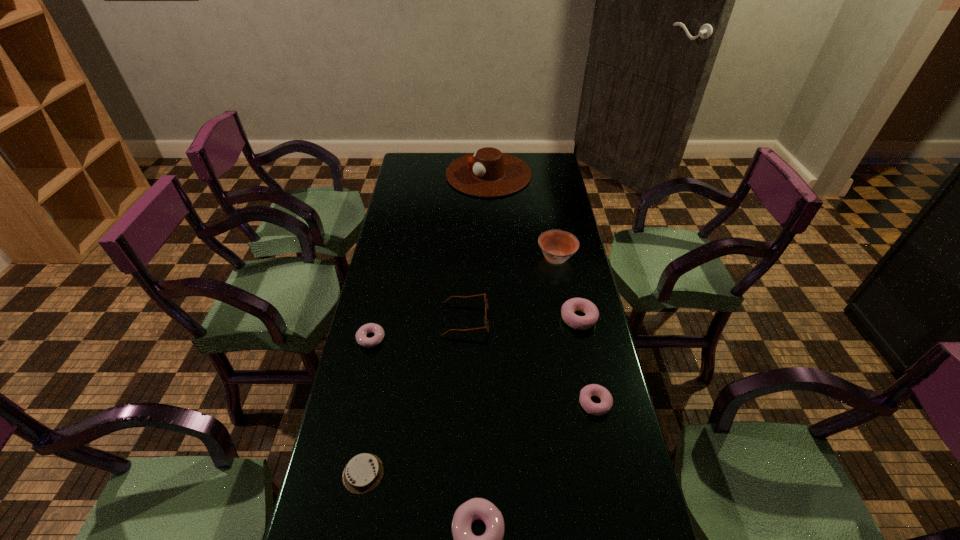
Locate an element on the screen. chocolate cake is located at coordinates (363, 472).

At what (x,y) coordinates should I click in order to perform the action: click on the shortest object. Please return your answer as a coordinate pair (x, y). Looking at the image, I should click on (363, 472).

Where is `free space located on the front-facing side of the cowboy hat`? The height and width of the screenshot is (540, 960). free space located on the front-facing side of the cowboy hat is located at coordinates (431, 174).

This screenshot has height=540, width=960. Find the location of `blank space located on the front-facing side of the cowboy hat`. blank space located on the front-facing side of the cowboy hat is located at coordinates (422, 174).

Where is `vacant space positioned on the front-facing side of the cowboy hat`? vacant space positioned on the front-facing side of the cowboy hat is located at coordinates click(407, 174).

The height and width of the screenshot is (540, 960). What are the coordinates of `vacant region located 0.310m on the left of the second farthest object` in the screenshot? It's located at (453, 258).

You are a GUI agent. You are given a task and a screenshot of the screen. Output one action in this format:
    pyautogui.click(x=<x>, y=<y>)
    Task: Click on the blank space located on the front-facing side of the sixth shortest object
    
    Given the screenshot: What is the action you would take?
    pyautogui.click(x=588, y=319)

This screenshot has width=960, height=540. What are the coordinates of `vacant area situated on the front of the bigger pink doughnut` in the screenshot? It's located at (604, 436).

Find the location of a particular element. free space located 0.200m on the back of the third farthest doughnut is located at coordinates (580, 333).

Find the location of a particular element. free spot located on the right of the smaller purple doughnut is located at coordinates (514, 339).